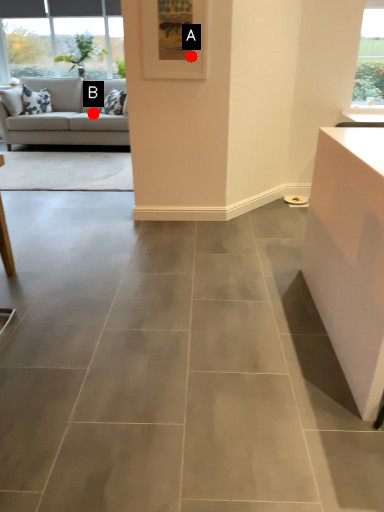
Question: Two points are circled on the image, labeled by A and B beside each circle. Among these points, which one is farthest from the camera?

Choices:
 (A) A is further
 (B) B is further

Answer: (B)